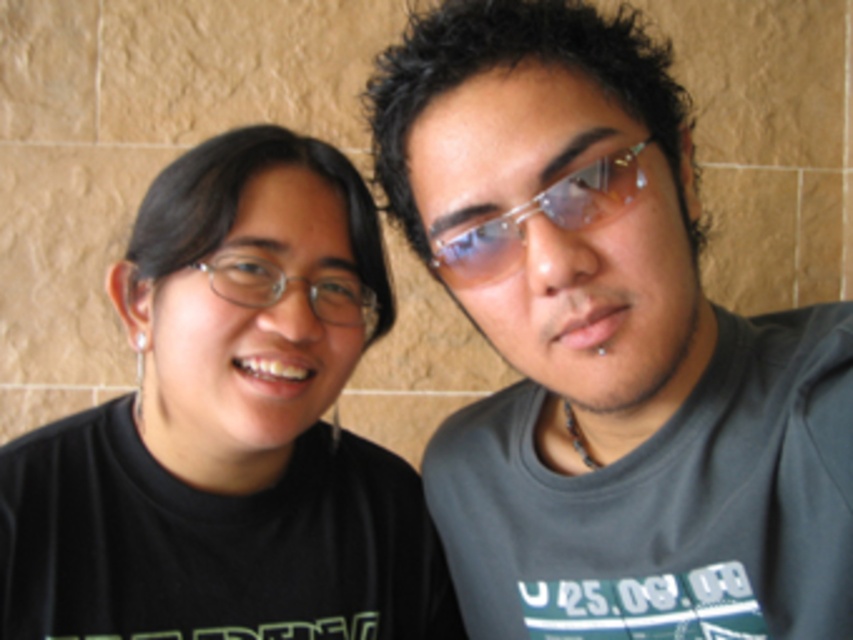
Between point (521, 300) and point (329, 304), which one is positioned in front?

Point (521, 300) is in front.

Is gray matte t-shirt at right smaller than clear plastic glasses at center?

Actually, gray matte t-shirt at right might be larger than clear plastic glasses at center.

What do you see at coordinates (610, 355) in the screenshot? This screenshot has height=640, width=853. I see `gray matte t-shirt at right` at bounding box center [610, 355].

I want to click on gray matte t-shirt at right, so click(610, 355).

Who is more forward, (492, 547) or (624, 163)?

Point (624, 163) is in front.

Locate an element on the screen. The image size is (853, 640). gray matte t-shirt at right is located at coordinates (610, 355).

Between sunglasses at center and clear plastic glasses at center, which one appears on the right side from the viewer's perspective?

sunglasses at center

Does sunglasses at center have a greater width compared to clear plastic glasses at center?

In fact, sunglasses at center might be narrower than clear plastic glasses at center.

Where is `sunglasses at center`? This screenshot has height=640, width=853. sunglasses at center is located at coordinates (544, 216).